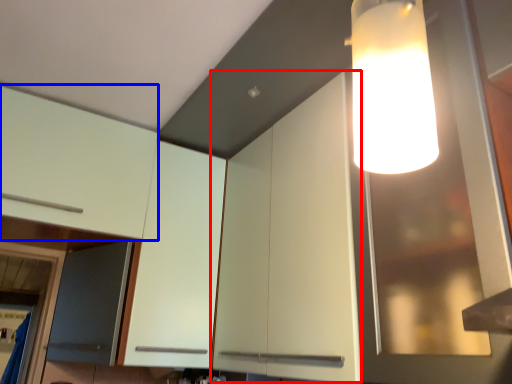
Question: Which object appears closest to the camera in this image, cabinetry (highlighted by a red box) or cabinetry (highlighted by a blue box)?

Choices:
 (A) cabinetry
 (B) cabinetry

Answer: (A)